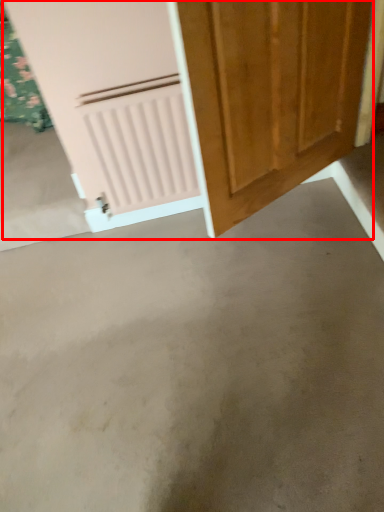
Question: In this image, where is door (annotated by the red box) located relative to concrete?

Choices:
 (A) right
 (B) left

Answer: (A)